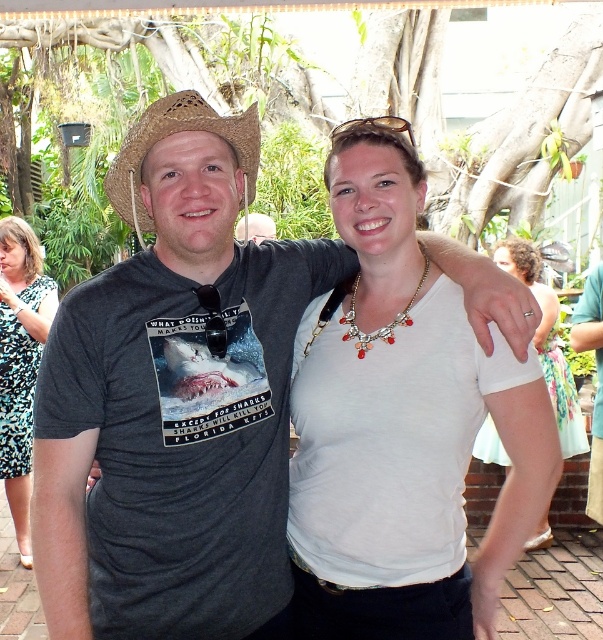
Question: Among these objects, which one is farthest from the camera?

Choices:
 (A) printed fabric dress at left
 (B) dark gray t-shirt at center
 (C) white matte tank top at center

Answer: (C)

Question: Does printed fabric dress at left appear on the left side of white matte tank top at center?

Choices:
 (A) no
 (B) yes

Answer: (B)

Question: Among these objects, which one is nearest to the camera?

Choices:
 (A) white matte tank top at center
 (B) printed fabric dress at left
 (C) dark gray t-shirt at center

Answer: (C)

Question: Considering the relative positions of printed fabric dress at left and strawmaterial/texturecowboy hat at left in the image provided, where is printed fabric dress at left located with respect to strawmaterial/texturecowboy hat at left?

Choices:
 (A) left
 (B) right

Answer: (A)

Question: In this image, where is white matte tank top at center located relative to matte gray t-shirt at center?

Choices:
 (A) right
 (B) left

Answer: (A)

Question: Which point is closer to the camera taking this photo?

Choices:
 (A) click(x=244, y=157)
 (B) click(x=235, y=237)
 (C) click(x=535, y=296)
 (D) click(x=24, y=536)

Answer: (A)